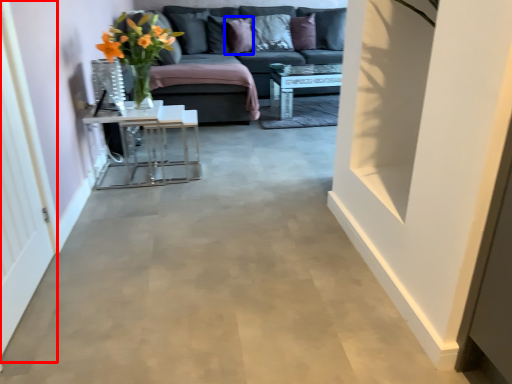
Question: Which object is further to the camera taking this photo, glass door (highlighted by a red box) or pillow (highlighted by a blue box)?

Choices:
 (A) glass door
 (B) pillow

Answer: (B)